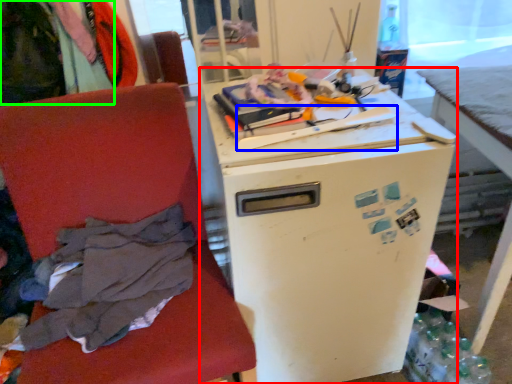
Question: Which object is positioned farthest from refrigerator (highlighted by a red box)? Select from equipment (highlighted by a blue box) and clothing (highlighted by a green box).

Choices:
 (A) equipment
 (B) clothing

Answer: (B)